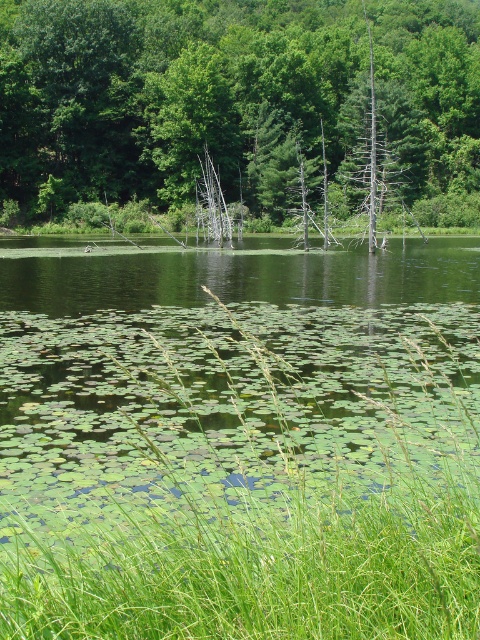
Question: Does green grass at lower left lie in front of green leafy tree at center?

Choices:
 (A) no
 (B) yes

Answer: (B)

Question: Is green grass at lower left below green leafy tree at center?

Choices:
 (A) yes
 (B) no

Answer: (A)

Question: Which object is closer to the camera taking this photo?

Choices:
 (A) green leafy tree at center
 (B) green grass at lower left

Answer: (B)

Question: Considering the relative positions of green grass at lower left and green leafy tree at center in the image provided, where is green grass at lower left located with respect to green leafy tree at center?

Choices:
 (A) left
 (B) right

Answer: (A)